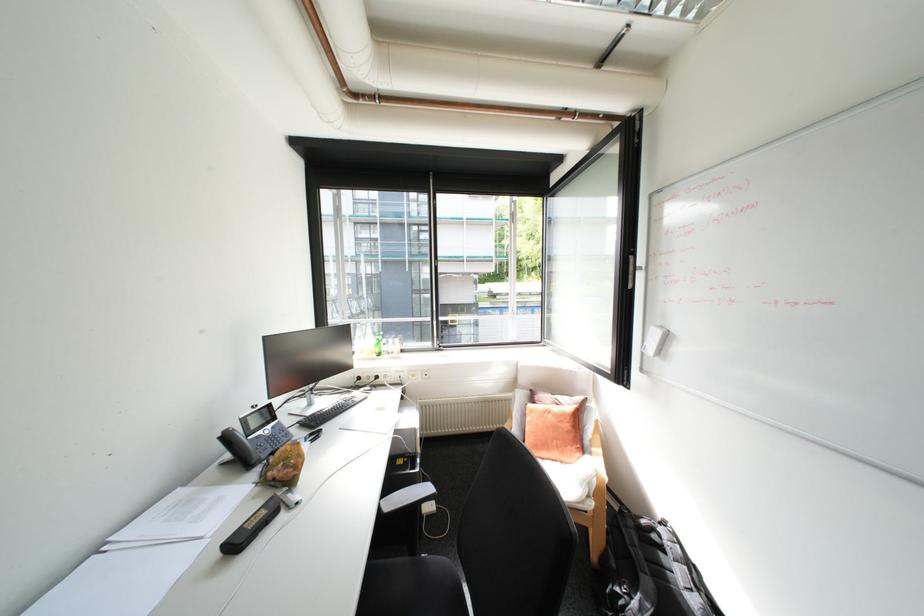
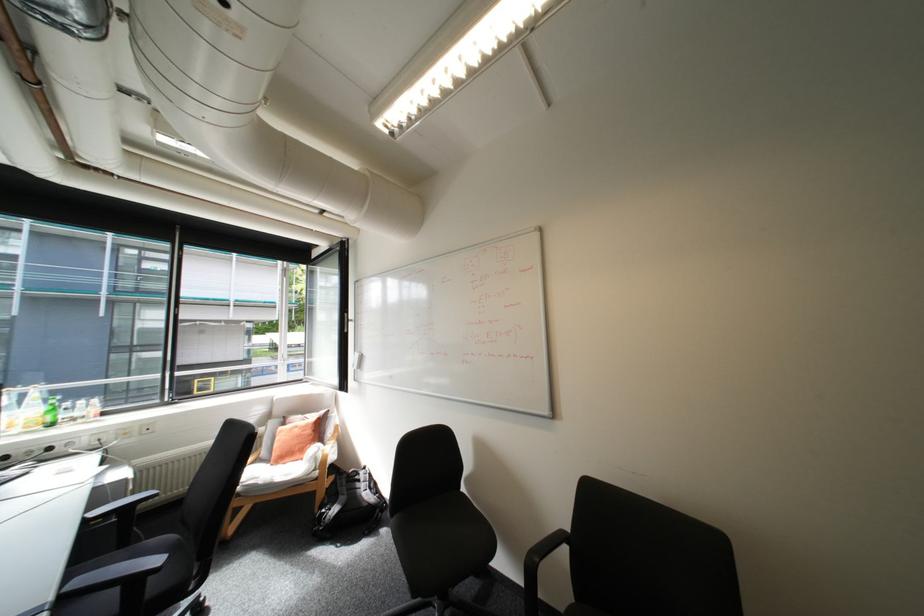
Find the pixel in the second image that matches pixel 379 354 in the first image.

(38, 427)